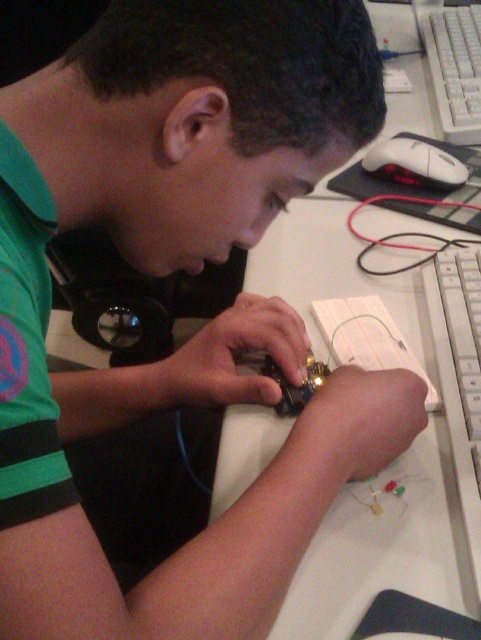
Question: Which object appears farthest from the camera in this image?

Choices:
 (A) white plastic keyboard at right
 (B) metallic circuit board at center
 (C) white plastic keyboard at upper right

Answer: (C)

Question: Is white plastic keyboard at upper right to the left of metallic circuit board at center from the viewer's perspective?

Choices:
 (A) no
 (B) yes

Answer: (A)

Question: Does white plastic keyboard at right lie in front of white plastic keyboard at upper right?

Choices:
 (A) no
 (B) yes

Answer: (B)

Question: Which of the following is the closest to the observer?

Choices:
 (A) white plastic keyboard at upper right
 (B) white plastic keyboard at right
 (C) metallic circuit board at center

Answer: (B)

Question: Which point appears farthest from the camera in this image?

Choices:
 (A) (427, 33)
 (B) (325, 378)
 (C) (450, 330)

Answer: (A)

Question: Is white plastic keyboard at right wider than white plastic keyboard at upper right?

Choices:
 (A) no
 (B) yes

Answer: (A)